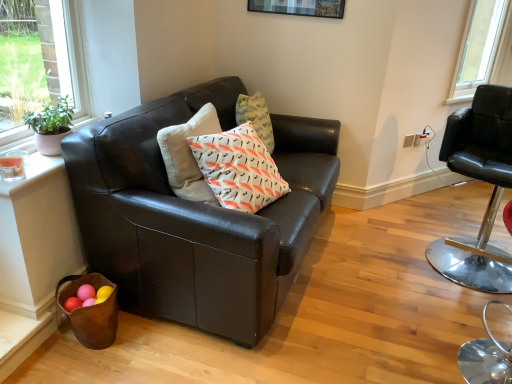
I want to click on matte black couch at center, so click(197, 217).

Measure the distance between matte black couch at center and camera.

They are 1.45 meters apart.

Describe the element at coordinates (197, 217) in the screenshot. The width and height of the screenshot is (512, 384). I see `matte black couch at center` at that location.

This screenshot has width=512, height=384. What do you see at coordinates (482, 180) in the screenshot?
I see `black leather chair at right` at bounding box center [482, 180].

The height and width of the screenshot is (384, 512). Identify the location of black leather chair at right. (482, 180).

Locate an element on the screen. This screenshot has width=512, height=384. matte black couch at center is located at coordinates (197, 217).

Which object is positioned more to the right, matte black couch at center or black leather chair at right?

black leather chair at right is more to the right.

Considering their positions, is matte black couch at center located in front of or behind black leather chair at right?

matte black couch at center is in front of black leather chair at right.

Is point (184, 300) positioned before point (486, 108)?

Yes, it is in front of point (486, 108).

From the image's perspective, is matte black couch at center above or below black leather chair at right?

Based on their image positions, matte black couch at center is located above black leather chair at right.

From a real-world perspective, who is located lower, matte black couch at center or black leather chair at right?

matte black couch at center is physically lower.

In terms of width, does matte black couch at center look wider or thinner when compared to black leather chair at right?

In the image, matte black couch at center appears to be wider than black leather chair at right.

In the scene shown: Considering the sizes of matte black couch at center and black leather chair at right in the image, is matte black couch at center taller or shorter than black leather chair at right?

matte black couch at center is shorter than black leather chair at right.

Does matte black couch at center have a larger size compared to black leather chair at right?

Indeed, matte black couch at center has a larger size compared to black leather chair at right.

Is black leather chair at right inside matte black couch at center?

That's incorrect, black leather chair at right is not inside matte black couch at center.

Would you say matte black couch at center is a long distance from black leather chair at right?

Yes, matte black couch at center is far from black leather chair at right.

Is matte black couch at center looking in the opposite direction of black leather chair at right?

No, black leather chair at right is not at the back of matte black couch at center.

What's the angular difference between matte black couch at center and black leather chair at right's facing directions?

They differ by 110 degrees in their facing directions.

You are a GUI agent. You are given a task and a screenshot of the screen. Output one action in this format:
    pyautogui.click(x=<x>, y=<y>)
    Task: Click on the chair located on the right of matte black couch at center
    
    Given the screenshot: What is the action you would take?
    pyautogui.click(x=482, y=180)

Does black leather chair at right appear on the left side of matte black couch at center?

No.

Considering the positions of objects black leather chair at right and matte black couch at center in the image provided, who is behind, black leather chair at right or matte black couch at center?

black leather chair at right is behind.

Is point (462, 114) positioned in front of point (245, 334)?

No, it is not.

From the image's perspective, which is above, black leather chair at right or matte black couch at center?

matte black couch at center.

From a real-world perspective, does black leather chair at right sit lower than matte black couch at center?

Incorrect, from a real-world perspective, black leather chair at right is higher than matte black couch at center.

In terms of width, does black leather chair at right look wider or thinner when compared to matte black couch at center?

black leather chair at right is thinner than matte black couch at center.

Can you confirm if black leather chair at right is taller than matte black couch at center?

Correct, black leather chair at right is much taller as matte black couch at center.

Can you confirm if black leather chair at right is smaller than matte black couch at center?

Yes, black leather chair at right is smaller than matte black couch at center.

Is black leather chair at right located outside matte black couch at center?

Yes, black leather chair at right is not within matte black couch at center.

Are black leather chair at right and matte black couch at center located far from each other?

Yes, black leather chair at right and matte black couch at center are located far from each other.

Is black leather chair at right looking in the opposite direction of matte black couch at center?

That's not correct — black leather chair at right is not looking away from matte black couch at center.

Locate an element on the screen. This screenshot has width=512, height=384. chair located below the matte black couch at center (from the image's perspective) is located at coordinates (482, 180).

In order to click on studio couch below the black leather chair at right (from a real-world perspective) in this screenshot , I will do `click(197, 217)`.

You are a GUI agent. You are given a task and a screenshot of the screen. Output one action in this format:
    pyautogui.click(x=<x>, y=<y>)
    Task: Click on the chair on the right of matte black couch at center
    
    Given the screenshot: What is the action you would take?
    pyautogui.click(x=482, y=180)